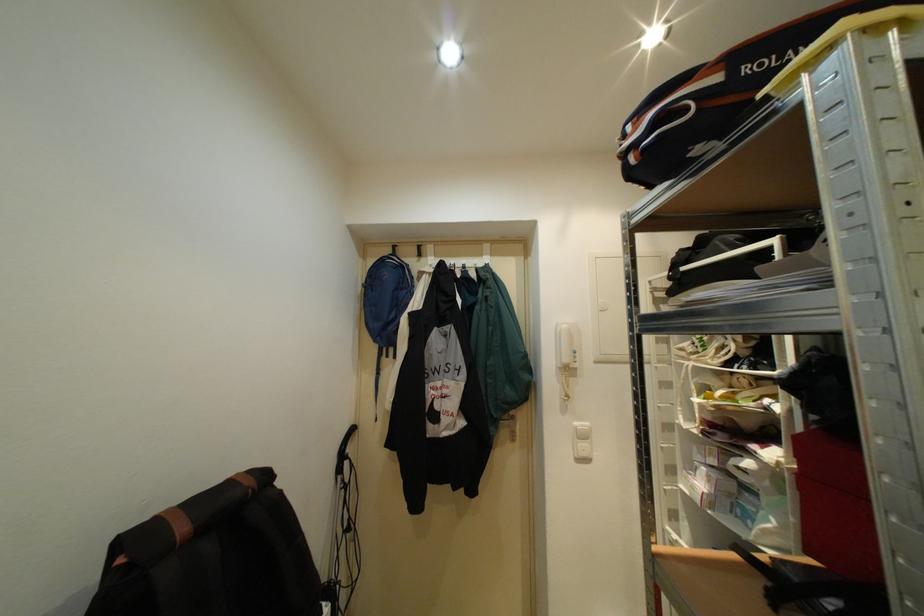
Find where to pull the brown strap handle. Please return your answer as a coordinate pair (x, y).

(188, 517)